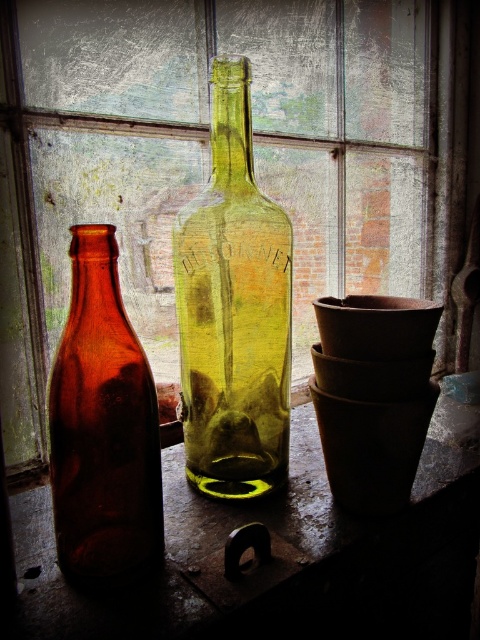
Who is positioned more to the left, green glass bottle at center or amber glass bottle at left?

amber glass bottle at left is more to the left.

Is point (468, 497) closer to viewer compared to point (153, 484)?

No, it is not.

I want to click on green glass bottle at center, so point(280,556).

Between transparent glass window at center and amber glass bottle at center, which one appears on the right side from the viewer's perspective?

Answer: amber glass bottle at center

Does transparent glass window at center have a greater width compared to amber glass bottle at center?

Yes, transparent glass window at center is wider than amber glass bottle at center.

The height and width of the screenshot is (640, 480). What are the coordinates of `transparent glass window at center` in the screenshot? It's located at (203, 157).

You are a GUI agent. You are given a task and a screenshot of the screen. Output one action in this format:
    pyautogui.click(x=<x>, y=<y>)
    Task: Click on the transparent glass window at center
    Image resolution: width=480 pixels, height=640 pixels.
    Given the screenshot: What is the action you would take?
    203,157

Is transparent glass window at center taller than amber glass bottle at left?

Yes, transparent glass window at center is taller than amber glass bottle at left.

Is point (308, 324) positioned after point (66, 416)?

Yes, it is.

At what (x,y) coordinates should I click in order to perform the action: click on transparent glass window at center. Please return your answer as a coordinate pair (x, y). This screenshot has width=480, height=640. Looking at the image, I should click on (203, 157).